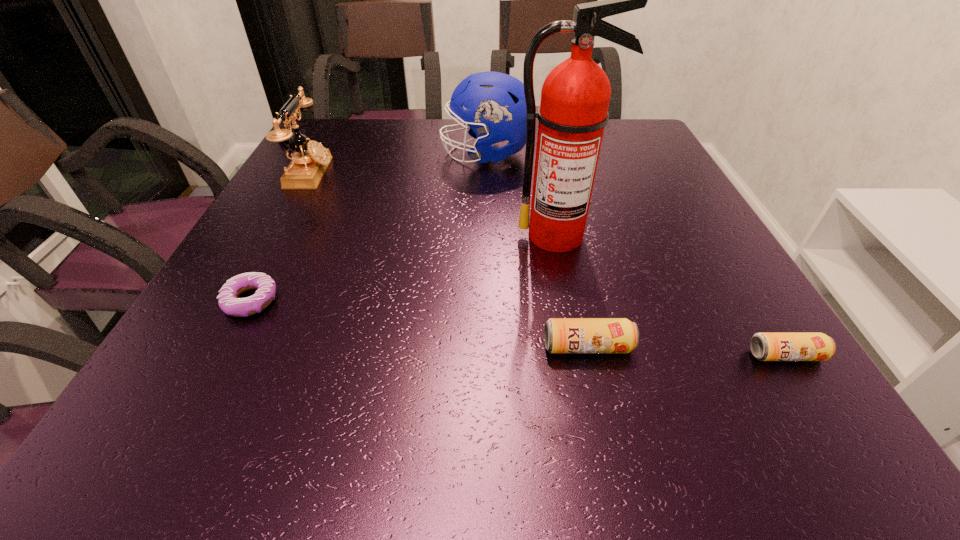
Find the location of a particular element. the fourth tallest object is located at coordinates (561, 335).

At what (x,y) coordinates should I click in order to perform the action: click on the taller beer can. Please return your answer as a coordinate pair (x, y). The height and width of the screenshot is (540, 960). Looking at the image, I should click on (561, 335).

You are a GUI agent. You are given a task and a screenshot of the screen. Output one action in this format:
    pyautogui.click(x=<x>, y=<y>)
    Task: Click on the rightmost object
    This screenshot has height=540, width=960.
    Given the screenshot: What is the action you would take?
    pyautogui.click(x=764, y=346)

You are a GUI agent. You are given a task and a screenshot of the screen. Output one action in this format:
    pyautogui.click(x=<x>, y=<y>)
    Task: Click on the second shortest object
    The width and height of the screenshot is (960, 540).
    Given the screenshot: What is the action you would take?
    pyautogui.click(x=764, y=346)

The width and height of the screenshot is (960, 540). Identify the location of football helmet. (497, 108).

Image resolution: width=960 pixels, height=540 pixels. I want to click on the fourth shortest object, so click(x=309, y=162).

You are a GUI agent. You are given a task and a screenshot of the screen. Output one action in this format:
    pyautogui.click(x=<x>, y=<y>)
    Task: Click on the shortest object
    The height and width of the screenshot is (540, 960).
    Given the screenshot: What is the action you would take?
    pos(228,301)

Identify the location of the fourth farthest object. (228, 301).

The image size is (960, 540). What are the coordinates of `fire extinguisher` in the screenshot? It's located at (573, 112).

The width and height of the screenshot is (960, 540). Identify the location of the third farthest object. (573, 112).